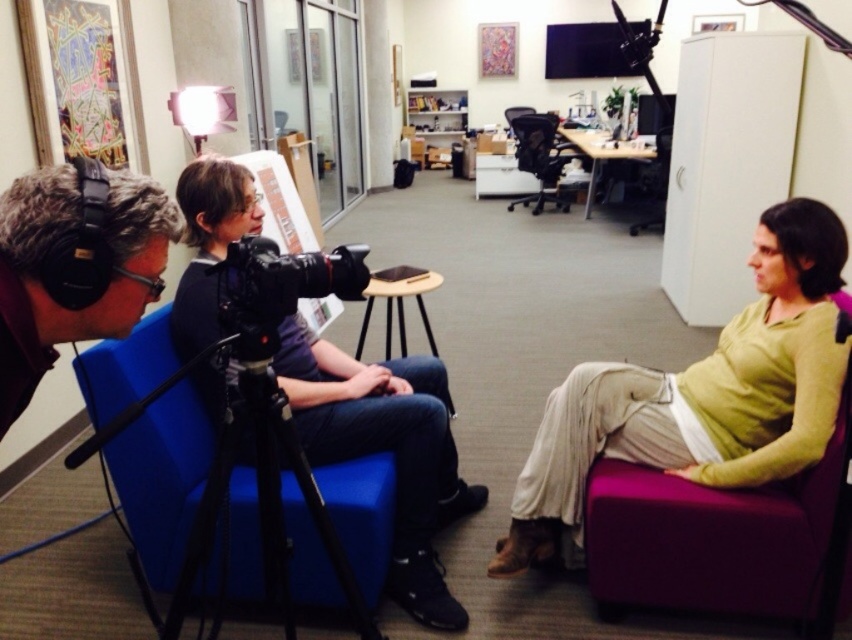
Is purple fabric swivel chair at right in front of black matte camera at center?

No, it is behind black matte camera at center.

Which is above, purple fabric swivel chair at right or black matte camera at center?

black matte camera at center

Between point (671, 570) and point (285, 266), which one is positioned in front?

Point (285, 266) is more forward.

The height and width of the screenshot is (640, 852). What are the coordinates of `purple fabric swivel chair at right` in the screenshot? It's located at (712, 538).

Which of these two, black metal tripod at center or black matte camera at center, stands taller?

With more height is black metal tripod at center.

Is black metal tripod at center further to the viewer compared to black matte camera at center?

That is False.

Does point (324, 541) come in front of point (227, 278)?

No.

Image resolution: width=852 pixels, height=640 pixels. Find the location of `black metal tripod at center`. black metal tripod at center is located at coordinates pos(260,484).

Can you confirm if purple fabric swivel chair at right is bigger than black matte headphones at left?

Correct, purple fabric swivel chair at right is larger in size than black matte headphones at left.

You are a GUI agent. You are given a task and a screenshot of the screen. Output one action in this format:
    pyautogui.click(x=<x>, y=<y>)
    Task: Click on the purple fabric swivel chair at right
    This screenshot has height=640, width=852.
    Given the screenshot: What is the action you would take?
    pyautogui.click(x=712, y=538)

Is point (816, 516) farther from camera compared to point (151, 268)?

Yes.

Where is `purple fabric swivel chair at right`? purple fabric swivel chair at right is located at coordinates (712, 538).